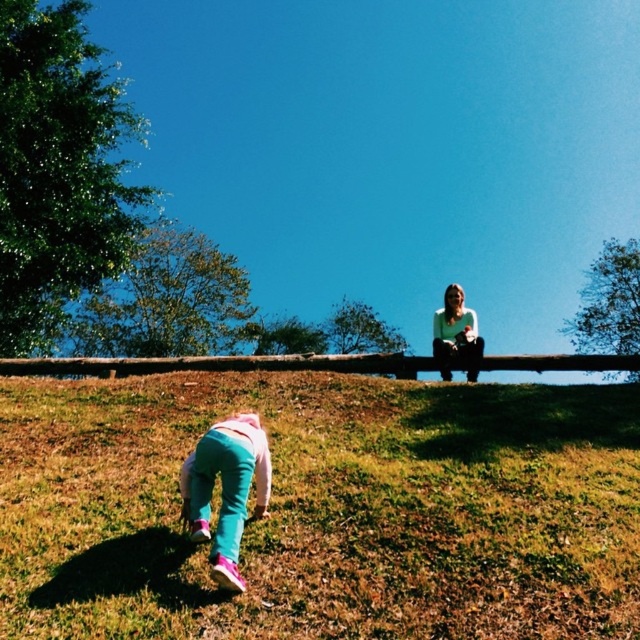
Question: Considering the real-world distances, which object is farthest from the teal fabric pants at lower left?

Choices:
 (A) green grassy at lower left
 (B) white matte shirt at upper center

Answer: (B)

Question: Is green grassy at lower left below teal fabric pants at lower left?

Choices:
 (A) yes
 (B) no

Answer: (B)

Question: Estimate the real-world distances between objects in this image. Which object is farther from the teal fabric pants at lower left?

Choices:
 (A) white matte shirt at upper center
 (B) green grassy at lower left

Answer: (A)

Question: Can you confirm if teal fabric pants at lower left is positioned to the right of white matte shirt at upper center?

Choices:
 (A) yes
 (B) no

Answer: (B)

Question: Does green grassy at lower left have a larger size compared to teal fabric pants at lower left?

Choices:
 (A) yes
 (B) no

Answer: (B)

Question: Estimate the real-world distances between objects in this image. Which object is farther from the white matte shirt at upper center?

Choices:
 (A) green grassy at lower left
 (B) teal fabric pants at lower left

Answer: (B)